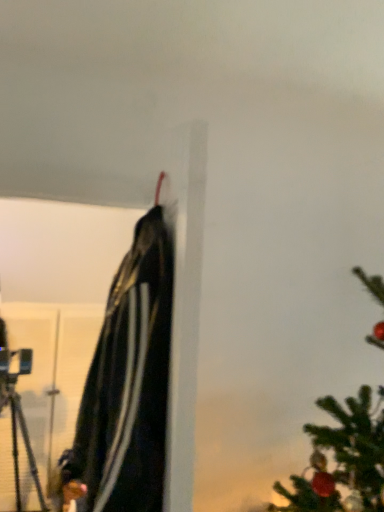
Question: From a real-world perspective, relative to black matte jacket at upper center, is black matte tripod at left vertically above or below?

Choices:
 (A) below
 (B) above

Answer: (A)

Question: Is black matte tripod at left bigger or smaller than black matte jacket at upper center?

Choices:
 (A) small
 (B) big

Answer: (B)

Question: Relative to black matte jacket at upper center, is black matte tripod at left in front or behind?

Choices:
 (A) behind
 (B) front

Answer: (A)

Question: Would you say black matte jacket at upper center is to the left or to the right of black matte tripod at left in the picture?

Choices:
 (A) left
 (B) right

Answer: (B)

Question: From a real-world perspective, relative to black matte tripod at left, is black matte jacket at upper center vertically above or below?

Choices:
 (A) above
 (B) below

Answer: (A)

Question: From the image's perspective, relative to black matte tripod at left, is black matte jacket at upper center above or below?

Choices:
 (A) above
 (B) below

Answer: (A)

Question: Considering their positions, is black matte jacket at upper center located in front of or behind black matte tripod at left?

Choices:
 (A) behind
 (B) front

Answer: (B)